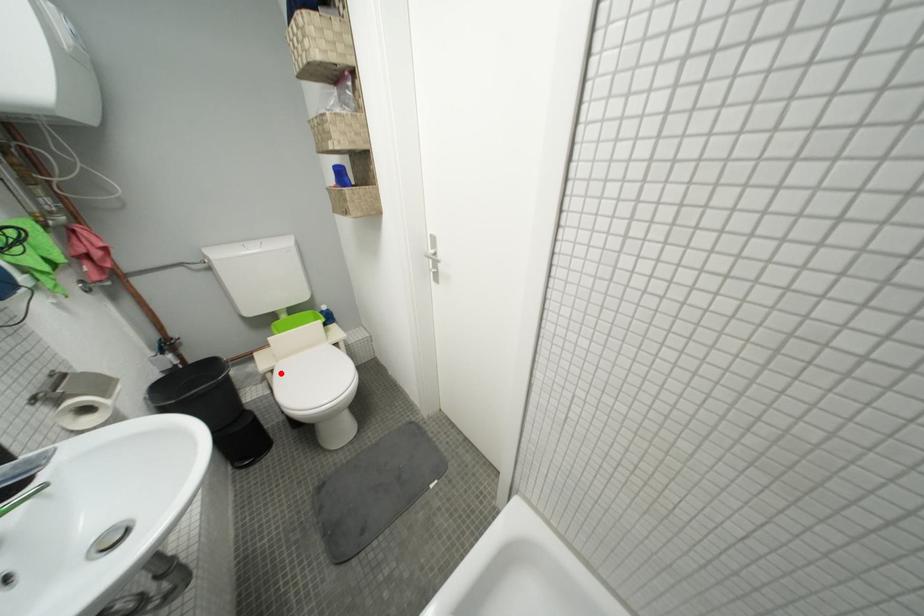
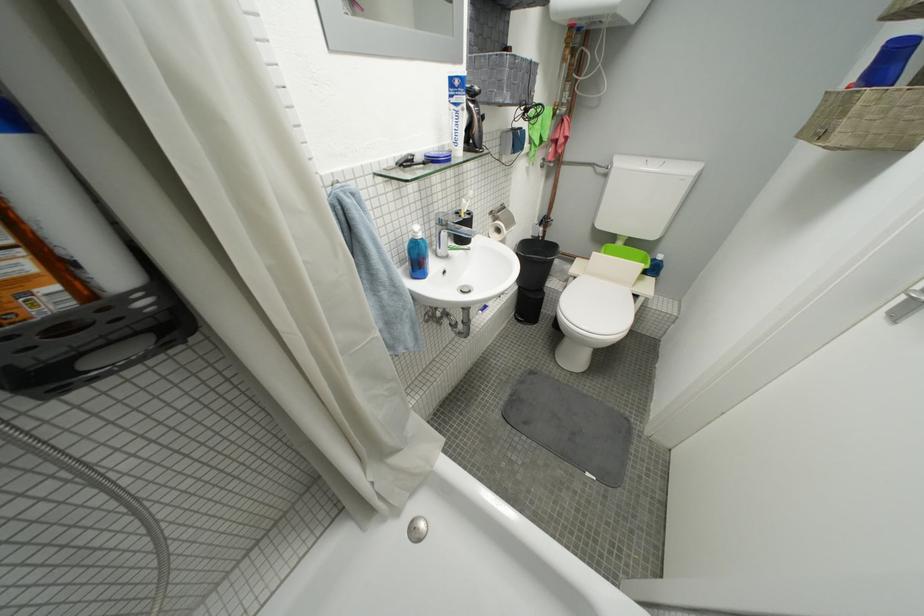
Where in the second image is the point corresponding to the highlighted location from the first image?

(584, 281)